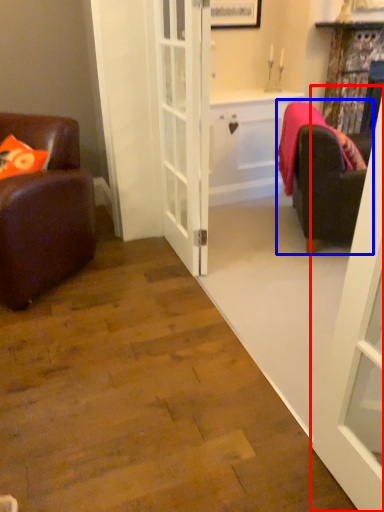
Question: Which object appears closest to the camera in this image, door (highlighted by a red box) or studio couch (highlighted by a blue box)?

Choices:
 (A) door
 (B) studio couch

Answer: (A)